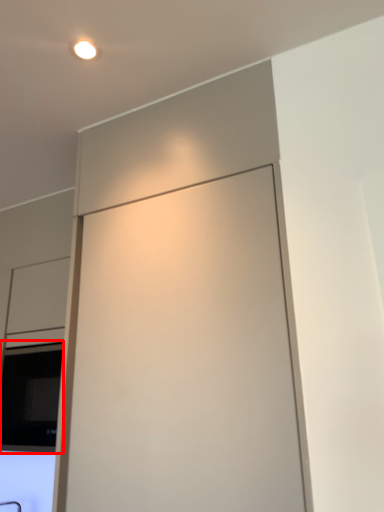
Question: Where is window (annotated by the red box) located in relation to screen door in the image?

Choices:
 (A) left
 (B) right

Answer: (A)